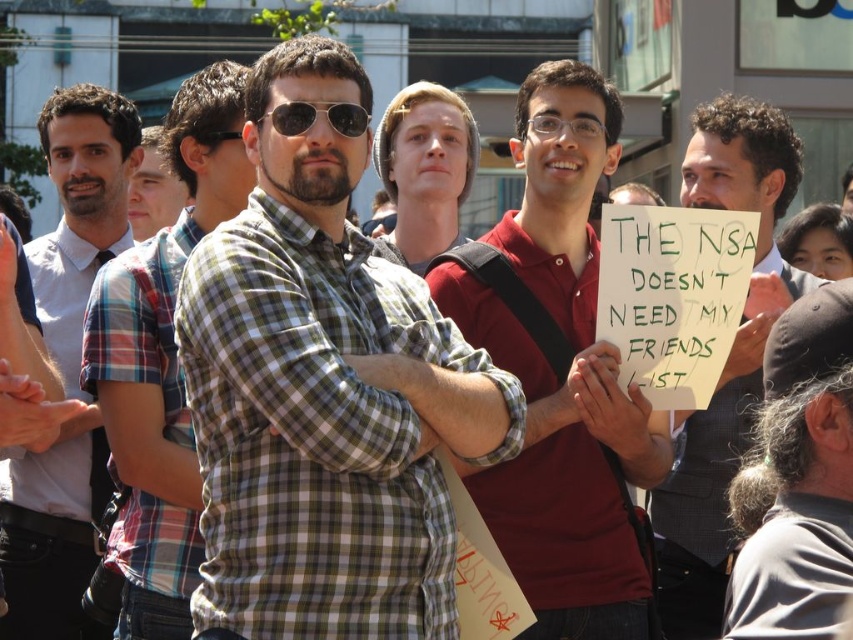
You are a GUI agent. You are given a task and a screenshot of the screen. Output one action in this format:
    pyautogui.click(x=<x>, y=<y>)
    Task: Click on the dark brown suit at center
    
    Given the screenshot: What is the action you would take?
    pyautogui.click(x=727, y=356)

What do you see at coordinates (727, 356) in the screenshot? This screenshot has width=853, height=640. I see `dark brown suit at center` at bounding box center [727, 356].

The image size is (853, 640). In order to click on dark brown suit at center in this screenshot , I will do `click(727, 356)`.

Does checkered fabric shirt at center appear on the left side of light brown knit hat at center?

Correct, you'll find checkered fabric shirt at center to the left of light brown knit hat at center.

The image size is (853, 640). Identify the location of checkered fabric shirt at center. (161, 364).

The height and width of the screenshot is (640, 853). I want to click on checkered fabric shirt at center, so click(x=161, y=364).

Does green plaid shirt at center have a lesser height compared to dark brown suit at center?

Correct, green plaid shirt at center is not as tall as dark brown suit at center.

Which is in front, point (270, 260) or point (695, 161)?

Point (270, 260) is in front.

Where is `green plaid shirt at center`? green plaid shirt at center is located at coordinates (323, 394).